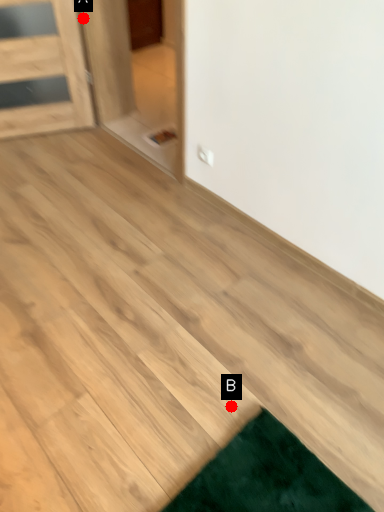
Question: Two points are circled on the image, labeled by A and B beside each circle. Which point is closer to the camera?

Choices:
 (A) A is closer
 (B) B is closer

Answer: (B)